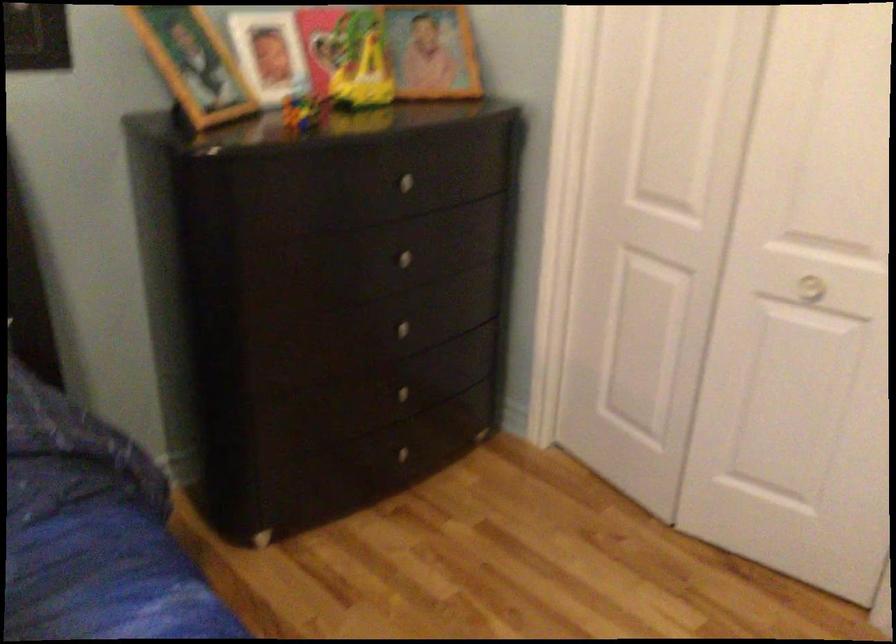
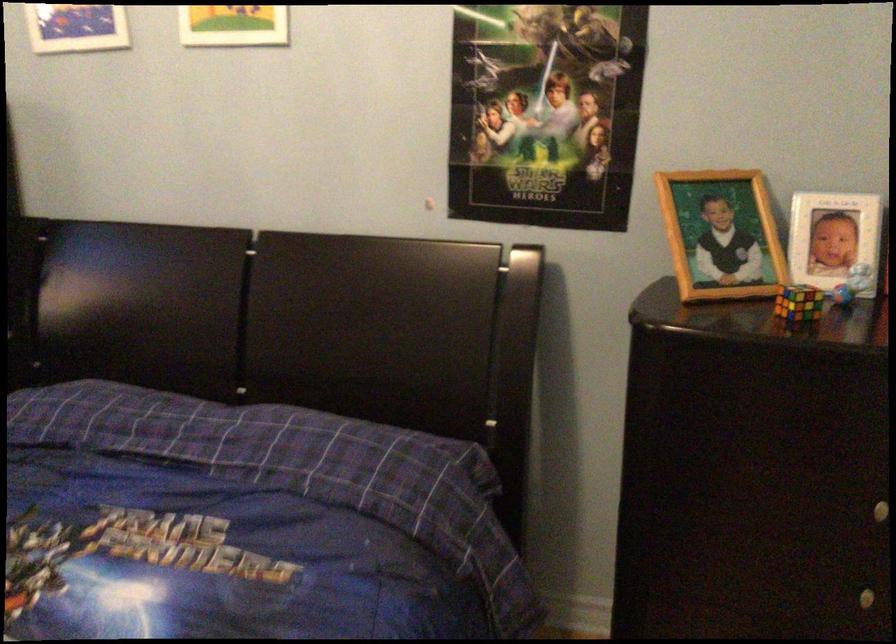
In the second image, find the point that corresponds to [304,108] in the first image.

(798, 303)